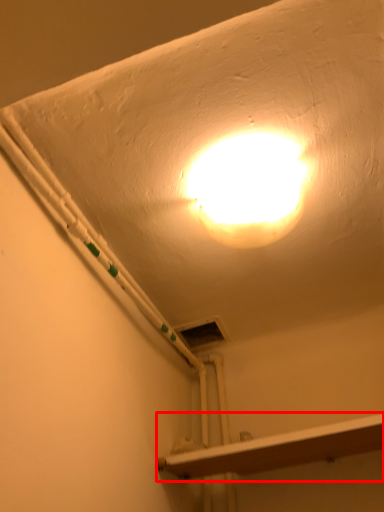
Question: Considering the relative positions of shelf (annotated by the red box) and lamp in the image provided, where is shelf (annotated by the red box) located with respect to the staircase?

Choices:
 (A) right
 (B) left

Answer: (A)